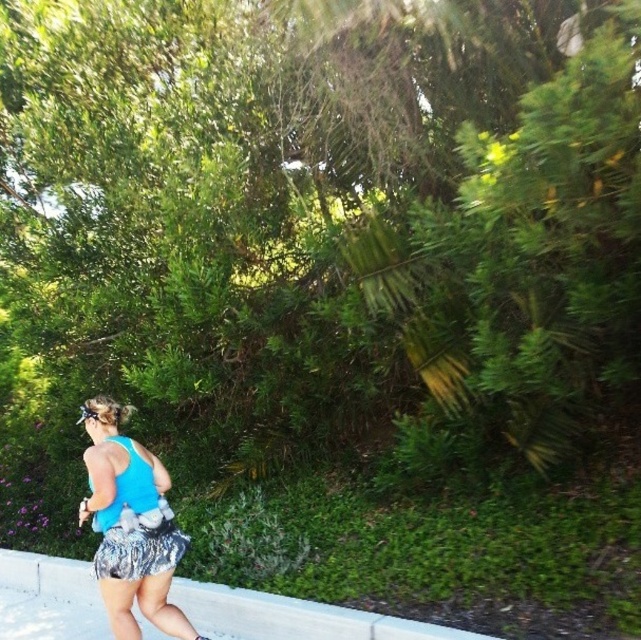
You are a photographer trying to capture the jogger in the image. The blue fabric tank top at center is located at point (129, 525). If you want to focus on the tank top, where should you aim your camera?

You should aim your camera at point (129, 525) to focus on the blue fabric tank top at center.